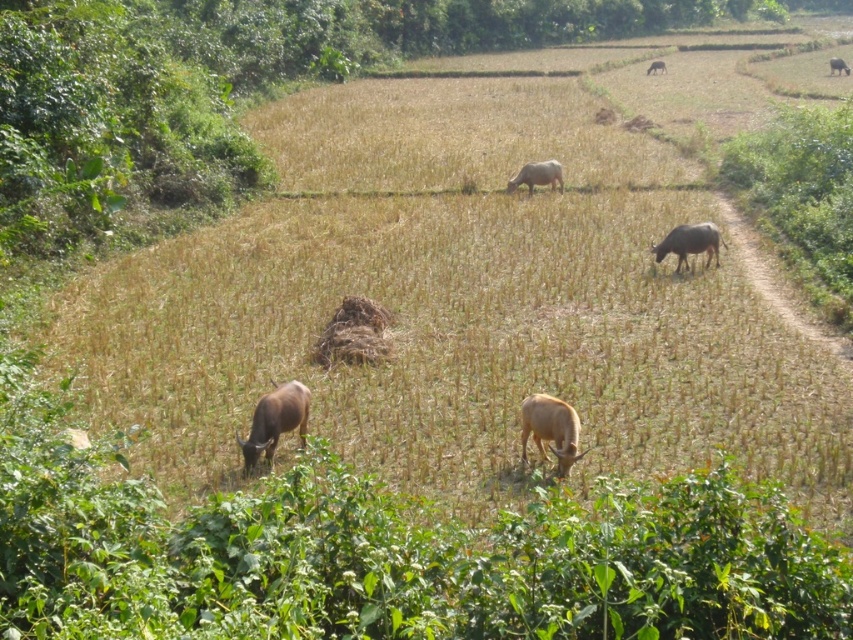
You are a farmer standing at the center of the field. You see two cows, the brown matte cow at lower left and the brown matte cow at upper right. Which cow is closer to you?

Result: The brown matte cow at lower left is closer to you because it is located below the brown matte cow at upper right, which is further away.

You are a farmer looking to separate your cows. You see a white matte cow at center and a brown matte cow at upper center. Which cow is positioned higher up in the field?

The brown matte cow at upper center is positioned higher up in the field than the white matte cow at center.

Consider the image. You are standing at the center of the field and want to locate the brown matte cow at lower left. According to the coordinates provided, in which direction should you move to find it?

The brown matte cow at lower left is located at coordinates point (276, 420). Since you are at the center, you should move towards the lower left direction to find it.